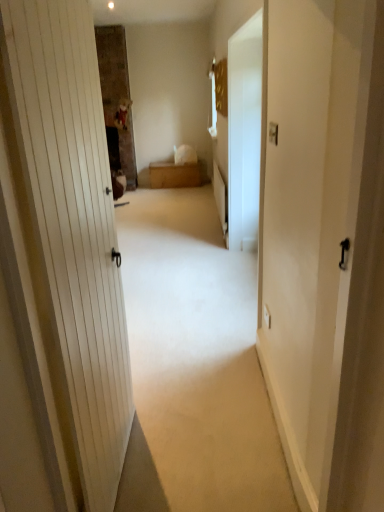
Question: Is white glossy screen door at center to the left of white matte door at center from the viewer's perspective?

Choices:
 (A) yes
 (B) no

Answer: (B)

Question: From the image's perspective, is white glossy screen door at center on top of white matte door at center?

Choices:
 (A) yes
 (B) no

Answer: (A)

Question: Is white glossy screen door at center not within white matte door at center?

Choices:
 (A) no
 (B) yes

Answer: (B)

Question: From a real-world perspective, is white glossy screen door at center located higher than white matte door at center?

Choices:
 (A) yes
 (B) no

Answer: (A)

Question: Is white glossy screen door at center looking in the opposite direction of white matte door at center?

Choices:
 (A) no
 (B) yes

Answer: (A)

Question: Considering the positions of wooden chest at center and white matte door at center in the image, is wooden chest at center wider or thinner than white matte door at center?

Choices:
 (A) wide
 (B) thin

Answer: (B)

Question: Is point tap(175, 184) positioned closer to the camera than point tap(130, 229)?

Choices:
 (A) farther
 (B) closer

Answer: (A)

Question: In the image, is wooden chest at center positioned in front of or behind white matte door at center?

Choices:
 (A) behind
 (B) front

Answer: (A)

Question: Is wooden chest at center taller or shorter than white matte door at center?

Choices:
 (A) short
 (B) tall

Answer: (B)

Question: Is point (157, 189) positioned closer to the camera than point (160, 168)?

Choices:
 (A) closer
 (B) farther

Answer: (B)

Question: Looking at the image, does white matte door at center seem bigger or smaller compared to wooden chest at center?

Choices:
 (A) small
 (B) big

Answer: (B)

Question: Is white matte door at center taller or shorter than wooden chest at center?

Choices:
 (A) tall
 (B) short

Answer: (B)

Question: Based on their positions, is white matte door at center located to the left or right of wooden chest at center?

Choices:
 (A) left
 (B) right

Answer: (B)

Question: Considering the positions of white matte door at center and white glossy screen door at center in the image, is white matte door at center taller or shorter than white glossy screen door at center?

Choices:
 (A) short
 (B) tall

Answer: (A)

Question: Looking at their shapes, would you say white matte door at center is wider or thinner than white glossy screen door at center?

Choices:
 (A) thin
 (B) wide

Answer: (B)